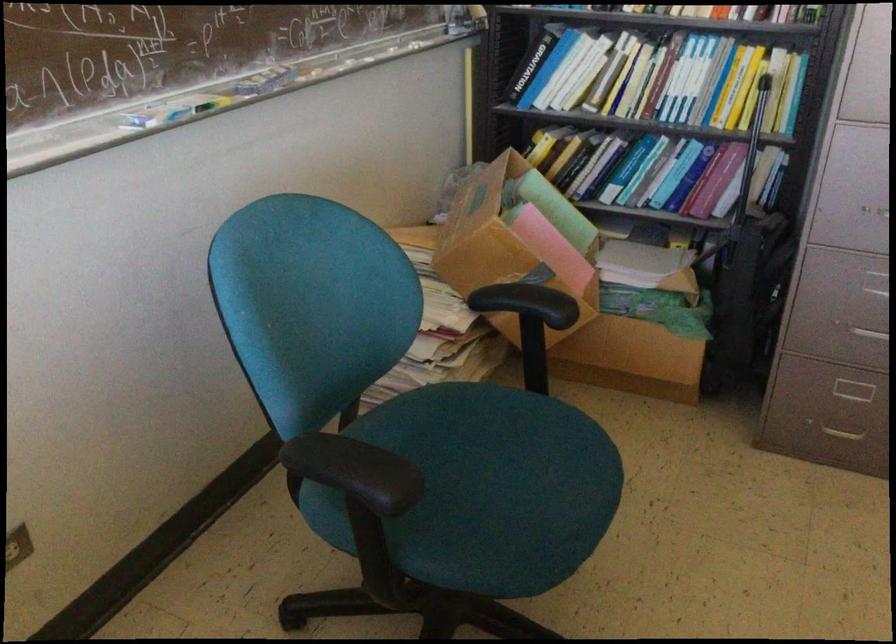
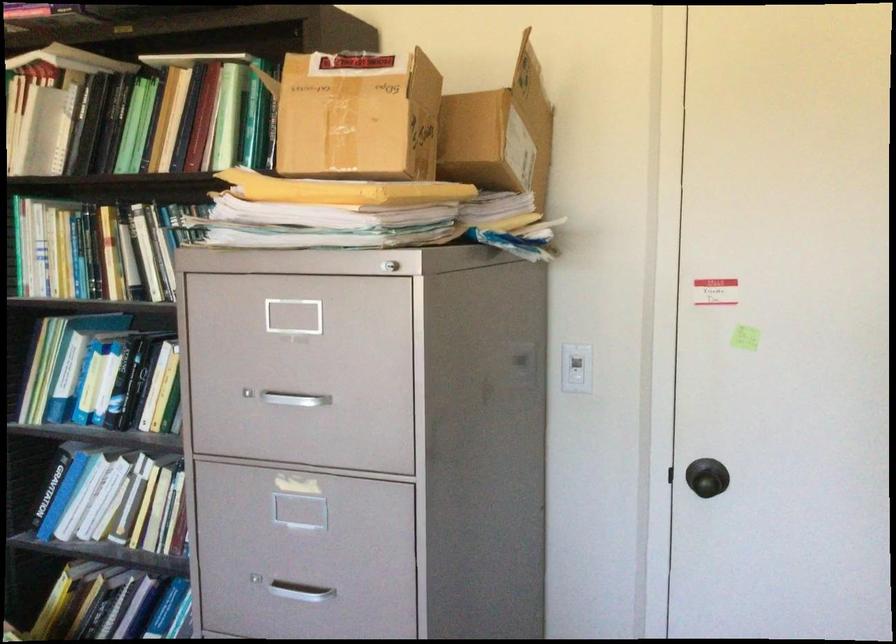
Question: Which direction would the cameraman need to move to produce the second image? Reply with the corresponding letter.

Choices:
 (A) Left
 (B) Right
 (C) Forward
 (D) Backward

Answer: (B)